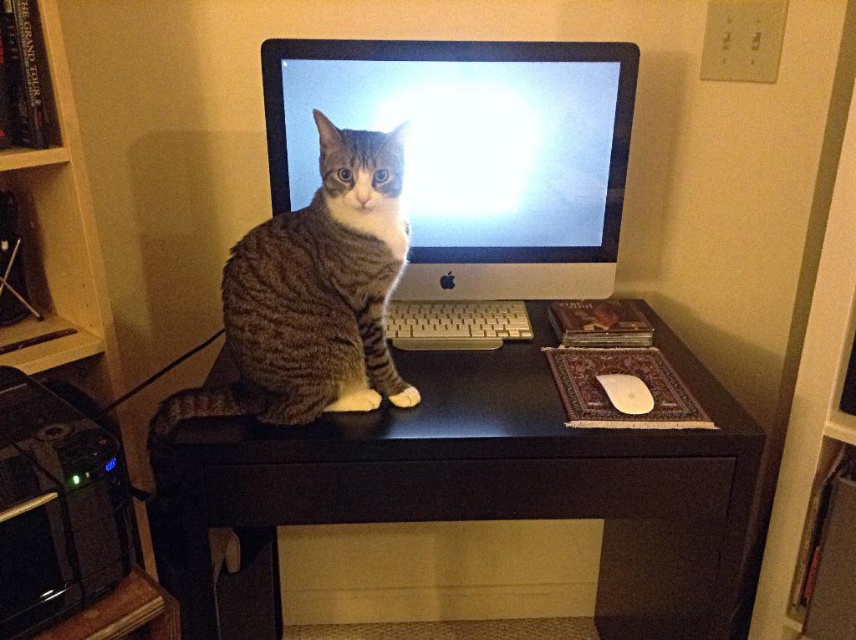
Who is positioned more to the right, satin silver monitor at center or tabby fur cat at center?

satin silver monitor at center

Is satin silver monitor at center positioned in front of tabby fur cat at center?

No, it is behind tabby fur cat at center.

What do you see at coordinates (473, 152) in the screenshot?
I see `satin silver monitor at center` at bounding box center [473, 152].

Locate an element on the screen. The image size is (856, 640). satin silver monitor at center is located at coordinates (473, 152).

Between satin silver monitor at center and silver metallic keyboard at center, which one appears on the right side from the viewer's perspective?

silver metallic keyboard at center

Does satin silver monitor at center have a smaller size compared to silver metallic keyboard at center?

Actually, satin silver monitor at center might be larger than silver metallic keyboard at center.

Image resolution: width=856 pixels, height=640 pixels. What are the coordinates of `satin silver monitor at center` in the screenshot? It's located at (473, 152).

Where is `satin silver monitor at center`? This screenshot has width=856, height=640. satin silver monitor at center is located at coordinates (473, 152).

Between black matte computer desk at center and silver metallic keyboard at center, which one is positioned lower?

black matte computer desk at center is below.

Which is behind, point (254, 502) or point (464, 340)?

Positioned behind is point (464, 340).

This screenshot has height=640, width=856. What do you see at coordinates (474, 488) in the screenshot? I see `black matte computer desk at center` at bounding box center [474, 488].

You are a GUI agent. You are given a task and a screenshot of the screen. Output one action in this format:
    pyautogui.click(x=<x>, y=<y>)
    Task: Click on the black matte computer desk at center
    Image resolution: width=856 pixels, height=640 pixels.
    Given the screenshot: What is the action you would take?
    pyautogui.click(x=474, y=488)